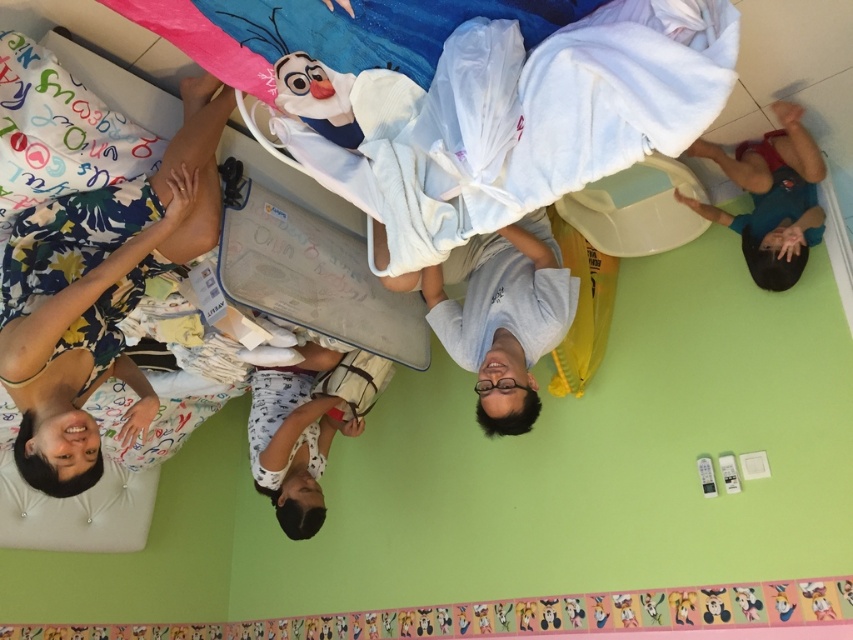
Who is taller, floral fabric dress at lower left or blue cotton shirt at lower right?

With more height is floral fabric dress at lower left.

Can you confirm if floral fabric dress at lower left is positioned above blue cotton shirt at lower right?

Incorrect, floral fabric dress at lower left is not positioned above blue cotton shirt at lower right.

The width and height of the screenshot is (853, 640). What do you see at coordinates (97, 292) in the screenshot?
I see `floral fabric dress at lower left` at bounding box center [97, 292].

You are a GUI agent. You are given a task and a screenshot of the screen. Output one action in this format:
    pyautogui.click(x=<x>, y=<y>)
    Task: Click on the floral fabric dress at lower left
    The image size is (853, 640).
    Given the screenshot: What is the action you would take?
    pyautogui.click(x=97, y=292)

Is white fabric bed at upper left taller than floral fabric dress at lower left?

In fact, white fabric bed at upper left may be shorter than floral fabric dress at lower left.

Is point (55, 202) farther from camera compared to point (53, 333)?

Yes, point (55, 202) is farther from viewer.

At what (x,y) coordinates should I click in order to perform the action: click on white fabric bed at upper left. Please return your answer as a coordinate pair (x, y). The image size is (853, 640). Looking at the image, I should click on (93, 179).

Can you confirm if white fabric bed at upper left is positioned above white cotton shirt at center?

Indeed, white fabric bed at upper left is positioned over white cotton shirt at center.

Does white fabric bed at upper left appear on the right side of white cotton shirt at center?

No, white fabric bed at upper left is not to the right of white cotton shirt at center.

Does point (27, 77) come farther from viewer compared to point (314, 360)?

No, (27, 77) is closer to viewer.

The image size is (853, 640). I want to click on white fabric bed at upper left, so click(x=93, y=179).